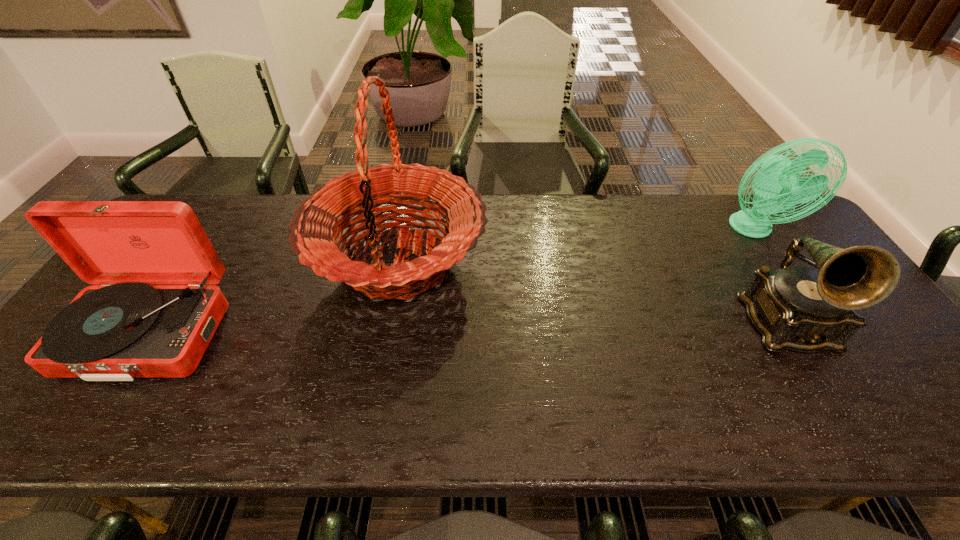
This screenshot has width=960, height=540. I want to click on fan situated at the far edge, so 777,184.

The width and height of the screenshot is (960, 540). What are the coordinates of `object located at the left edge` in the screenshot? It's located at (124, 329).

This screenshot has height=540, width=960. What are the coordinates of `phonograph record located at the right edge` in the screenshot? It's located at (795, 308).

In order to click on fan situated at the right edge in this screenshot , I will do `click(777, 184)`.

Find the location of a particular element. The image size is (960, 540). object that is at the far right corner is located at coordinates (777, 184).

This screenshot has width=960, height=540. Find the location of `free location at the far edge`. free location at the far edge is located at coordinates (687, 193).

Locate an element on the screen. The height and width of the screenshot is (540, 960). vacant area at the right edge of the desktop is located at coordinates (867, 332).

Locate an element on the screen. The image size is (960, 540). vacant space at the far left corner is located at coordinates (209, 217).

Where is `vacant space at the near left corner of the desktop`? This screenshot has height=540, width=960. vacant space at the near left corner of the desktop is located at coordinates (84, 401).

Where is `vacant space at the near right corner`? Image resolution: width=960 pixels, height=540 pixels. vacant space at the near right corner is located at coordinates (930, 433).